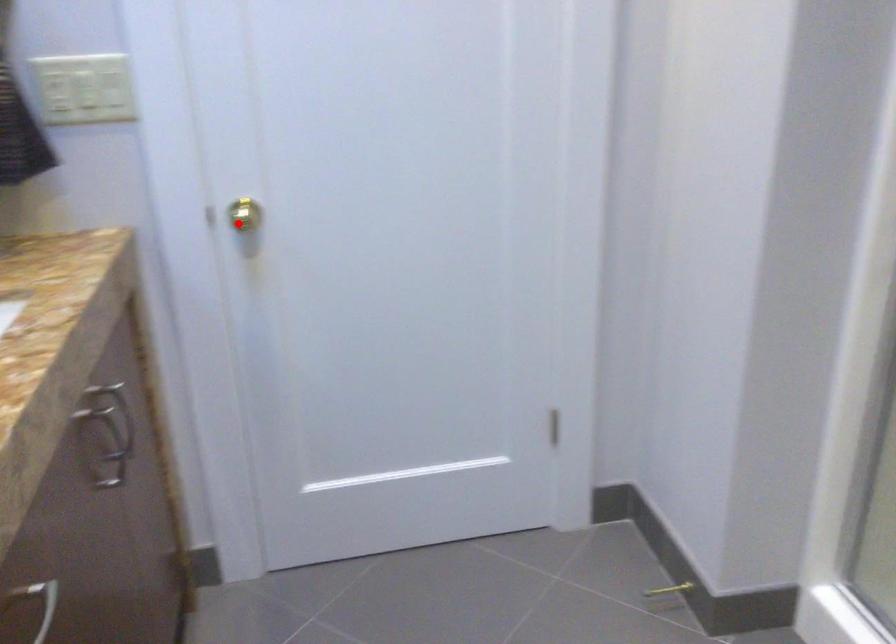
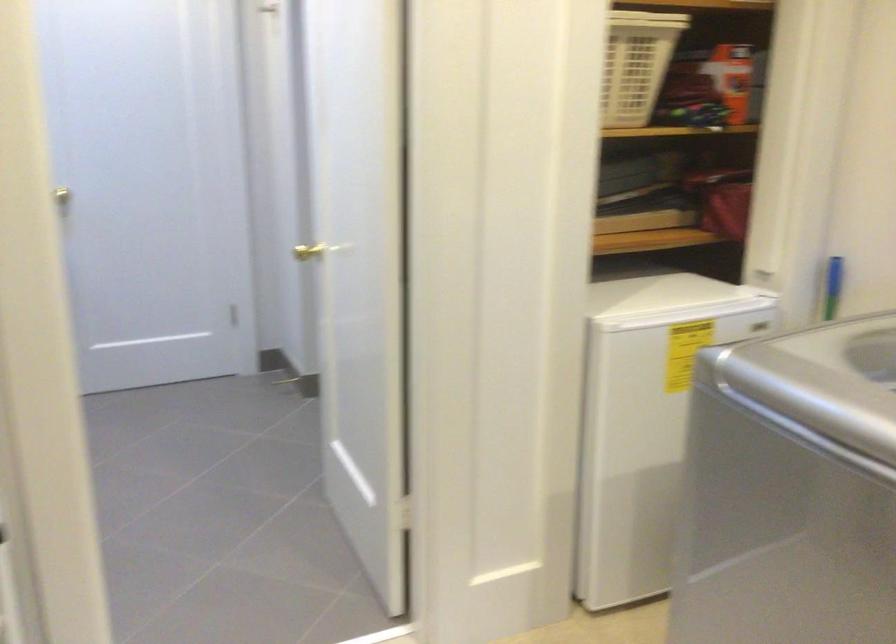
Question: I am providing you with two images of the same scene from different viewpoints. In image1, a red point is highlighted. Considering the same 3D point in image2, which of the following is correct?

Choices:
 (A) It is closer
 (B) It is farther

Answer: (B)